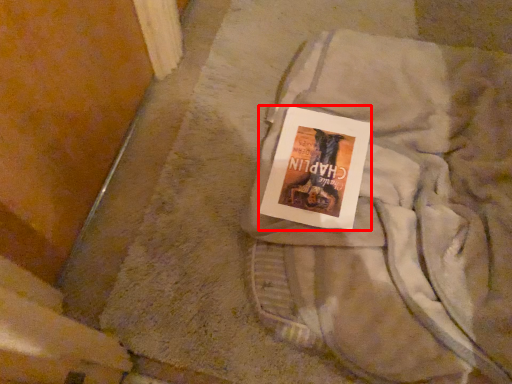
Question: From the image's perspective, what is the correct spatial positioning of paperback book (annotated by the red box) in reference to laundry?

Choices:
 (A) above
 (B) below

Answer: (A)